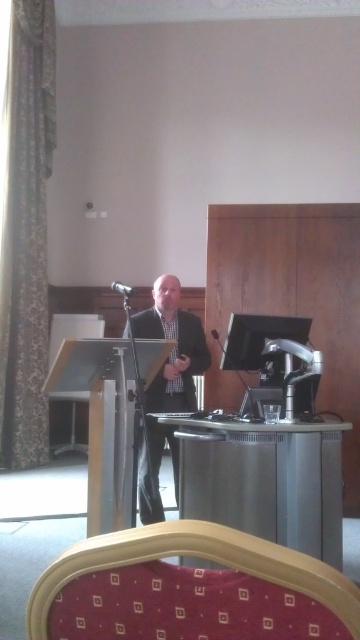
You are an event organizer setting up the conference room. You need to ensure that the dark suit at center and the black matte microphone at center are visible to all attendees. Based on their sizes, which object might require positioning closer to the front for better visibility?

The dark suit at center might be wider than the black matte microphone at center, so the dark suit at center may need to be positioned closer to the front to ensure its width is clearly visible to all attendees.

You are standing in the conference room and need to move from the podium to the desk with the computer monitor. Which point, point (177, 504) or point (132, 291), is closer to the desk?

Point (177, 504) is in front of point (132, 291), so it is closer to the desk with the computer monitor.

You are an attendee at the presentation. You notice the dark suit at center and the black matte microphone at center. Which object is closer to the speaker?

The dark suit at center is positioned under the black matte microphone at center, meaning the dark suit at center is closer to the speaker since it is below the microphone.